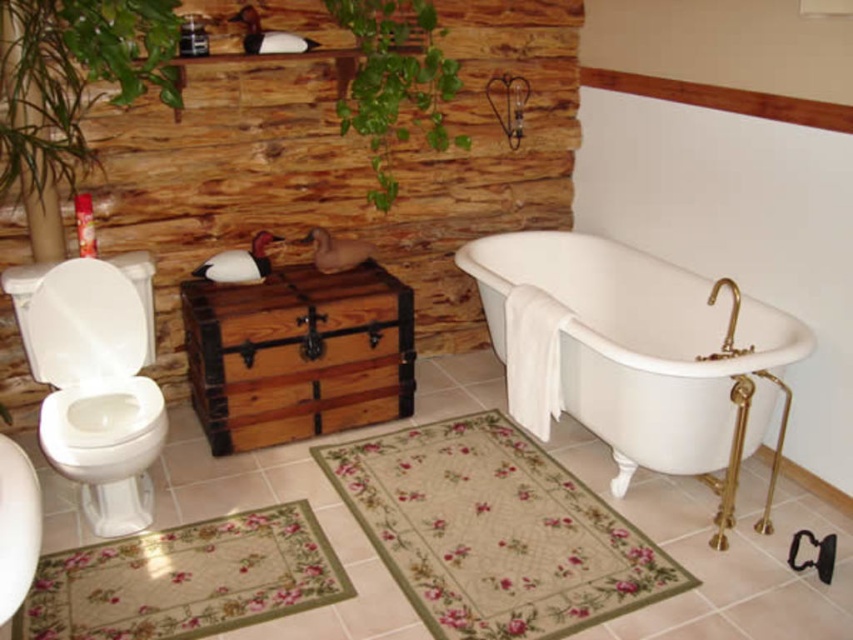
Looking at this image, is floral carpet at lower center positioned at the back of white porcelain bathtub at center?

No, floral carpet at lower center is in front of white porcelain bathtub at center.

Does point (584, 570) come farther from viewer compared to point (679, 442)?

That is False.

Locate an element on the screen. The width and height of the screenshot is (853, 640). floral carpet at lower center is located at coordinates (494, 531).

Find the location of a particular element. This screenshot has width=853, height=640. floral carpet at lower left is located at coordinates (184, 579).

Does point (206, 618) come in front of point (33, 307)?

Yes.

Does point (236, 524) come closer to viewer compared to point (123, 273)?

Yes, point (236, 524) is in front of point (123, 273).

Identify the location of floral carpet at lower left. The image size is (853, 640). (184, 579).

Is white glossy toilet bowl at left positioned behind white glossy sink at lower left?

Yes, it is.

Locate an element on the screen. The width and height of the screenshot is (853, 640). white glossy toilet bowl at left is located at coordinates (94, 381).

At what (x,y) coordinates should I click in order to perform the action: click on white glossy toilet bowl at left. Please return your answer as a coordinate pair (x, y). The image size is (853, 640). Looking at the image, I should click on (94, 381).